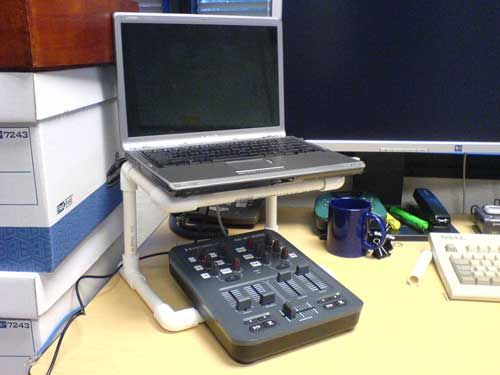
At what (x,y) coordinates should I click in order to perform the action: click on desk. Please return your answer as a coordinate pair (x, y). This screenshot has width=500, height=375. Looking at the image, I should click on (394, 337).